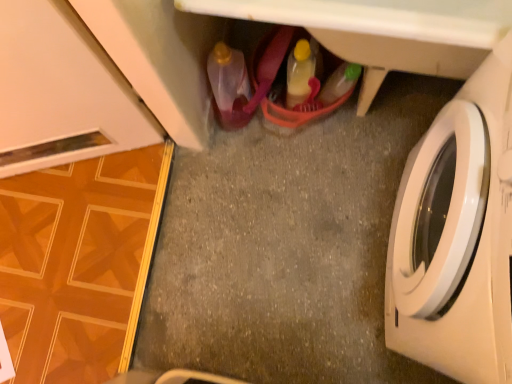
Image resolution: width=512 pixels, height=384 pixels. What do you see at coordinates (229, 86) in the screenshot?
I see `translucent plastic bottle at lower center, which is the 1th bottle in left-to-right order` at bounding box center [229, 86].

Locate an element on the screen. The height and width of the screenshot is (384, 512). translucent yellow plastic bottle at center, which appears as the first bottle when viewed from the right is located at coordinates (298, 73).

Measure the distance between point (321,231) and camera.

A distance of 4.34 feet exists between point (321,231) and camera.

You are a GUI agent. You are given a task and a screenshot of the screen. Output one action in this format:
    pyautogui.click(x=<x>, y=<y>)
    Task: Click on the translucent plastic bottle at lower center, which is the 1th bottle in left-to-right order
    This screenshot has height=384, width=512.
    Given the screenshot: What is the action you would take?
    pyautogui.click(x=229, y=86)

Is white glossy washing machine at right looking in the opposite direction of translucent yellow plastic bottle at center, which appears as the first bottle when viewed from the right?

No, translucent yellow plastic bottle at center, which appears as the first bottle when viewed from the right, is not at the back of white glossy washing machine at right.

Is translucent yellow plastic bottle at center, which appears as the first bottle when viewed from the right, surrounded by white glossy washing machine at right?

No, translucent yellow plastic bottle at center, which appears as the first bottle when viewed from the right, is not a part of white glossy washing machine at right.

Between white glossy washing machine at right and translucent yellow plastic bottle at center, which appears as the first bottle when viewed from the right, which one has smaller size?

translucent yellow plastic bottle at center, which appears as the first bottle when viewed from the right.

From a real-world perspective, is white glossy washing machine at right over translucent yellow plastic bottle at center, which is the second bottle in left-to-right order?

Yes, from a real-world perspective, white glossy washing machine at right is on top of translucent yellow plastic bottle at center, which is the second bottle in left-to-right order.

From a real-world perspective, is translucent yellow plastic bottle at center, which is the second bottle in left-to-right order, physically located above or below white glossy washing machine at right?

Clearly, from a real-world perspective, translucent yellow plastic bottle at center, which is the second bottle in left-to-right order, is below white glossy washing machine at right.

Do you think translucent yellow plastic bottle at center, which appears as the first bottle when viewed from the right, is within white glossy washing machine at right, or outside of it?

translucent yellow plastic bottle at center, which appears as the first bottle when viewed from the right, lies outside white glossy washing machine at right.

Would you consider translucent yellow plastic bottle at center, which appears as the first bottle when viewed from the right, to be distant from white glossy washing machine at right?

translucent yellow plastic bottle at center, which appears as the first bottle when viewed from the right, is near white glossy washing machine at right, not far away.

Is white plastic cabinet at center located within white glossy washing machine at right?

Actually, white plastic cabinet at center is outside white glossy washing machine at right.

Looking at this image, how many degrees apart are the facing directions of white glossy washing machine at right and white plastic cabinet at center?

The facing directions of white glossy washing machine at right and white plastic cabinet at center are 91.2 degrees apart.

From a real-world perspective, does white glossy washing machine at right sit lower than white plastic cabinet at center?

No, from a real-world perspective, white glossy washing machine at right is not under white plastic cabinet at center.

Could you tell me if white glossy washing machine at right is facing white plastic cabinet at center?

No, white glossy washing machine at right is not aimed at white plastic cabinet at center.

From the image's perspective, would you say smooth gray concrete at center is shown under translucent plastic bottle at lower center, which is the 1th bottle in left-to-right order?

Yes.

Is smooth gray concrete at center wider than translucent plastic bottle at lower center, which is the 1th bottle in left-to-right order?

Yes.

Considering the relative positions of smooth gray concrete at center and translucent plastic bottle at lower center, which is the 1th bottle in left-to-right order, in the image provided, is smooth gray concrete at center in front of translucent plastic bottle at lower center, which is the 1th bottle in left-to-right order,?

No, the depth of smooth gray concrete at center is greater than that of translucent plastic bottle at lower center, which is the 1th bottle in left-to-right order.

Is smooth gray concrete at center directly adjacent to translucent plastic bottle at lower center, which is the 1th bottle in left-to-right order?

smooth gray concrete at center and translucent plastic bottle at lower center, which is the 1th bottle in left-to-right order, are not in contact.

Which of these two, white plastic cabinet at center or smooth gray concrete at center, is smaller?

Smaller between the two is smooth gray concrete at center.

Which is nearer, (467, 62) or (291, 174)?

Positioned in front is point (467, 62).

Does white plastic cabinet at center appear on the right side of smooth gray concrete at center?

Correct, you'll find white plastic cabinet at center to the right of smooth gray concrete at center.

How different are the orientations of smooth gray concrete at center and white plastic cabinet at center in degrees?

The facing directions of smooth gray concrete at center and white plastic cabinet at center are 89.8 degrees apart.

Identify the location of cabinetry above the smooth gray concrete at center (from the image's perspective). The image size is (512, 384). (384, 31).

Does smooth gray concrete at center come in front of white plastic cabinet at center?

No, it is behind white plastic cabinet at center.

Does smooth gray concrete at center have a greater height compared to white plastic cabinet at center?

Incorrect, the height of smooth gray concrete at center is not larger of that of white plastic cabinet at center.

From a real-world perspective, which is physically below, translucent plastic bottle at lower center, arranged as the 2th bottle when viewed from the right, or translucent yellow plastic bottle at center, which appears as the first bottle when viewed from the right?

From a 3D spatial view, translucent plastic bottle at lower center, arranged as the 2th bottle when viewed from the right, is below.

Does translucent plastic bottle at lower center, arranged as the 2th bottle when viewed from the right, have a smaller size compared to translucent yellow plastic bottle at center, which appears as the first bottle when viewed from the right?

Actually, translucent plastic bottle at lower center, arranged as the 2th bottle when viewed from the right, might be larger than translucent yellow plastic bottle at center, which appears as the first bottle when viewed from the right.

Does translucent plastic bottle at lower center, arranged as the 2th bottle when viewed from the right, lie in front of translucent yellow plastic bottle at center, which is the second bottle in left-to-right order?

That is True.

This screenshot has height=384, width=512. I want to click on the 1st bottle counting from the left side of the white glossy washing machine at right, so click(x=298, y=73).

Where is `the 2nd bottle positioned above the white glossy washing machine at right (from the image's perspective)`? The image size is (512, 384). the 2nd bottle positioned above the white glossy washing machine at right (from the image's perspective) is located at coordinates (298, 73).

Considering their positions, is translucent plastic bottle at lower center, which is the 1th bottle in left-to-right order, positioned further to white glossy washing machine at right than smooth gray concrete at center?

translucent plastic bottle at lower center, which is the 1th bottle in left-to-right order.

Looking at the image, which one is located further to white plastic cabinet at center, white glossy washing machine at right or smooth gray concrete at center?

smooth gray concrete at center lies further to white plastic cabinet at center than the other object.

Estimate the real-world distances between objects in this image. Which object is further from translucent yellow plastic bottle at center, which is the second bottle in left-to-right order, white glossy washing machine at right or white plastic cabinet at center?

Based on the image, white glossy washing machine at right appears to be further to translucent yellow plastic bottle at center, which is the second bottle in left-to-right order.

Based on their spatial positions, is white plastic cabinet at center or translucent yellow plastic bottle at center, which is the second bottle in left-to-right order, further from smooth gray concrete at center?

The object further to smooth gray concrete at center is white plastic cabinet at center.

Which object lies further to the anchor point white plastic cabinet at center, smooth gray concrete at center or white glossy washing machine at right?

smooth gray concrete at center is positioned further to the anchor white plastic cabinet at center.

Estimate the real-world distances between objects in this image. Which object is closer to translucent plastic bottle at lower center, which is the 1th bottle in left-to-right order, white plastic cabinet at center or smooth gray concrete at center?

Among the two, smooth gray concrete at center is located nearer to translucent plastic bottle at lower center, which is the 1th bottle in left-to-right order.

From the image, which object appears to be farther from white plastic cabinet at center, translucent yellow plastic bottle at center, which is the second bottle in left-to-right order, or white glossy washing machine at right?

white glossy washing machine at right is positioned further to the anchor white plastic cabinet at center.

From the image, which object appears to be farther from white plastic cabinet at center, white glossy washing machine at right or translucent yellow plastic bottle at center, which is the second bottle in left-to-right order?

white glossy washing machine at right is further to white plastic cabinet at center.

What are the coordinates of `cabinetry positioned between white glossy washing machine at right and smooth gray concrete at center from near to far` in the screenshot? It's located at (384, 31).

Locate an element on the screen. This screenshot has width=512, height=384. cabinetry between white glossy washing machine at right and translucent yellow plastic bottle at center, which appears as the first bottle when viewed from the right, from front to back is located at coordinates (384, 31).

This screenshot has width=512, height=384. Identify the location of bottle situated between translucent plastic bottle at lower center, which is the 1th bottle in left-to-right order, and white plastic cabinet at center from left to right. (298, 73).

You are a GUI agent. You are given a task and a screenshot of the screen. Output one action in this format:
    pyautogui.click(x=<x>, y=<y>)
    Task: Click on the bottle located between white glossy washing machine at right and translucent yellow plastic bottle at center, which is the second bottle in left-to-right order, in the depth direction
    The image size is (512, 384).
    Given the screenshot: What is the action you would take?
    pyautogui.click(x=229, y=86)